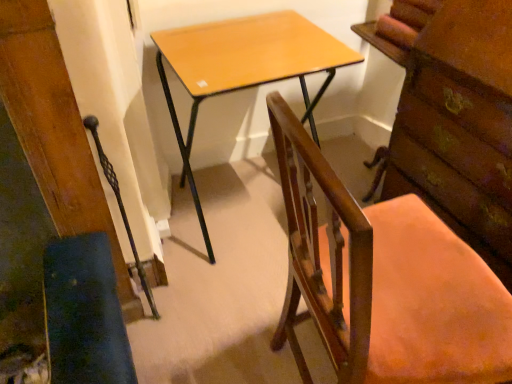
Question: Is wooden swivel chair at lower left wider or thinner than light brown wood desk at center?

Choices:
 (A) wide
 (B) thin

Answer: (B)

Question: In terms of size, does wooden swivel chair at lower left appear bigger or smaller than light brown wood desk at center?

Choices:
 (A) big
 (B) small

Answer: (B)

Question: Estimate the real-world distances between objects in this image. Which object is closer to the wooden chair at center?

Choices:
 (A) wooden swivel chair at lower left
 (B) wooden chest of drawers at right
 (C) light brown wood desk at center

Answer: (B)

Question: Which object is the closest to the wooden chest of drawers at right?

Choices:
 (A) wooden swivel chair at lower left
 (B) light brown wood desk at center
 (C) wooden chair at center

Answer: (C)